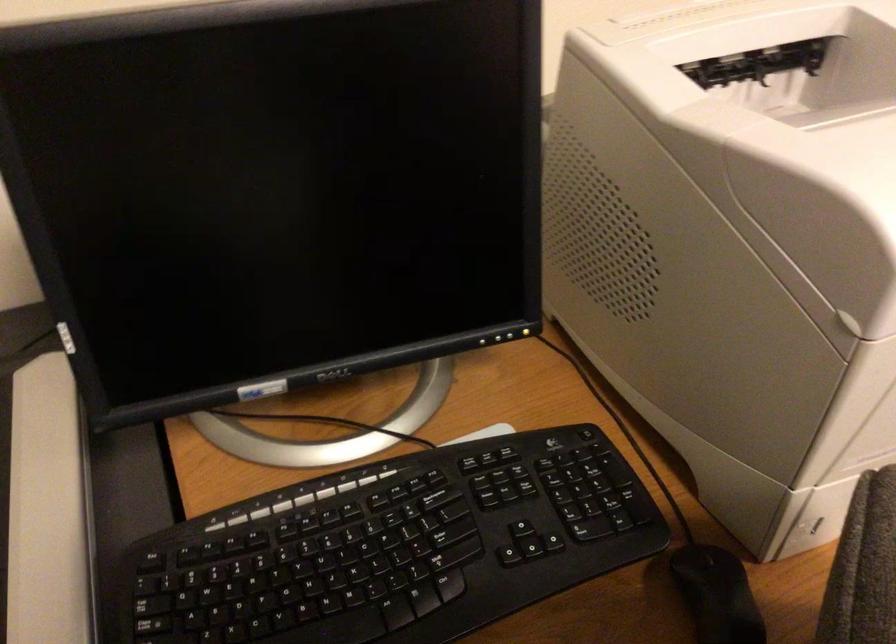
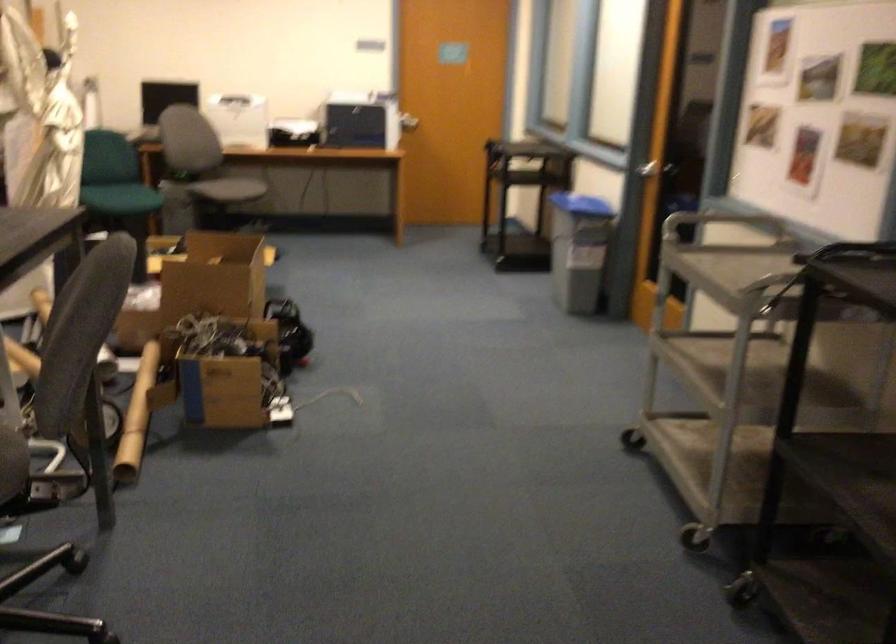
Question: I am providing you with two images of the same scene from different viewpoints. After the viewpoint changes to image2, which objects are now occluded?

Choices:
 (A) black filament spool
 (B) cardboard tube
 (C) silver door handle
 (D) black keyboard key

Answer: (D)